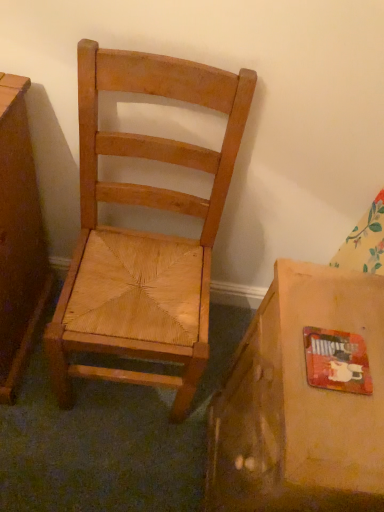
Question: Does point (97, 314) appear closer or farther from the camera than point (339, 305)?

Choices:
 (A) closer
 (B) farther

Answer: (B)

Question: Is natural wood chair at center in front of or behind matte cardboard box at lower right in the image?

Choices:
 (A) behind
 (B) front

Answer: (A)

Question: From the image's perspective, is natural wood chair at center located above or below matte cardboard box at lower right?

Choices:
 (A) below
 (B) above

Answer: (B)

Question: From a real-world perspective, is matte cardboard box at lower right positioned above or below natural wood chair at center?

Choices:
 (A) below
 (B) above

Answer: (A)

Question: Considering the positions of matte cardboard box at lower right and natural wood chair at center in the image, is matte cardboard box at lower right taller or shorter than natural wood chair at center?

Choices:
 (A) short
 (B) tall

Answer: (A)

Question: Does point (238, 473) appear closer or farther from the camera than point (66, 286)?

Choices:
 (A) farther
 (B) closer

Answer: (B)

Question: From the image's perspective, is matte cardboard box at lower right above or below natural wood chair at center?

Choices:
 (A) above
 (B) below

Answer: (B)